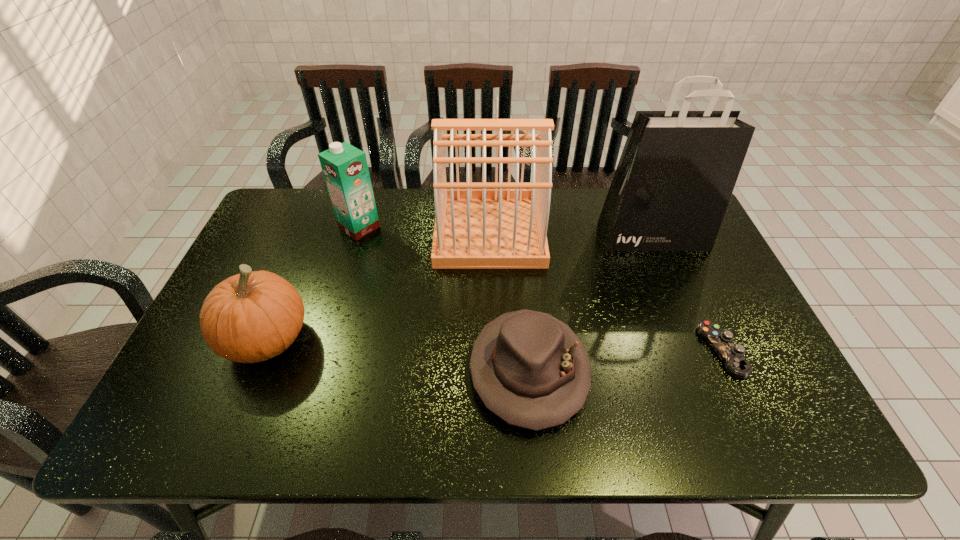
Where is `free location that satisfies the following two spatial constraints: 1. on the stem of the shortest object; 2. on the left side of the fourth tallest object`? This screenshot has height=540, width=960. free location that satisfies the following two spatial constraints: 1. on the stem of the shortest object; 2. on the left side of the fourth tallest object is located at coordinates (262, 350).

The width and height of the screenshot is (960, 540). Find the location of `vacant space that satisfies the following two spatial constraints: 1. on the front with handles of the shopping bag; 2. on the stem of the third shortest object`. vacant space that satisfies the following two spatial constraints: 1. on the front with handles of the shopping bag; 2. on the stem of the third shortest object is located at coordinates (696, 339).